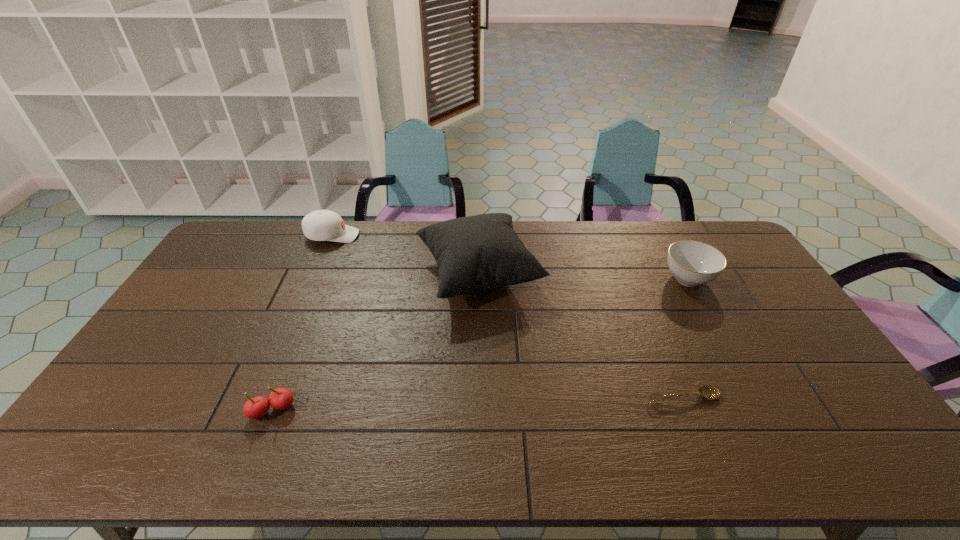
This screenshot has height=540, width=960. In order to click on blank area in the image that satisfies the following two spatial constraints: 1. on the front-facing side of the baseball cap; 2. on the left side of the chinaware in this screenshot , I will do `click(314, 279)`.

Where is `vacant space that satisfies the following two spatial constraints: 1. on the front-facing side of the baseball cap; 2. on the back side of the tallest object`? vacant space that satisfies the following two spatial constraints: 1. on the front-facing side of the baseball cap; 2. on the back side of the tallest object is located at coordinates (316, 275).

Find the location of a particular element. This screenshot has width=960, height=540. vacant space that satisfies the following two spatial constraints: 1. on the front side of the ladle; 2. on the right side of the tallest object is located at coordinates (478, 398).

The image size is (960, 540). In order to click on vacant space that satisfies the following two spatial constraints: 1. on the front-facing side of the cushion; 2. on the right side of the baseball cap in this screenshot , I will do `click(316, 275)`.

The image size is (960, 540). Identify the location of free point that satisfies the following two spatial constraints: 1. on the back side of the third object from left to right; 2. on the right side of the cherry. (326, 275).

The width and height of the screenshot is (960, 540). In order to click on vacant space that satisfies the following two spatial constraints: 1. on the back side of the cherry; 2. on the left side of the shortest object in this screenshot , I will do `click(277, 398)`.

Image resolution: width=960 pixels, height=540 pixels. What are the coordinates of `blank area in the image that satisfies the following two spatial constraints: 1. on the front-facing side of the tallest object; 2. on the left side of the baseball cap` in the screenshot? It's located at (316, 275).